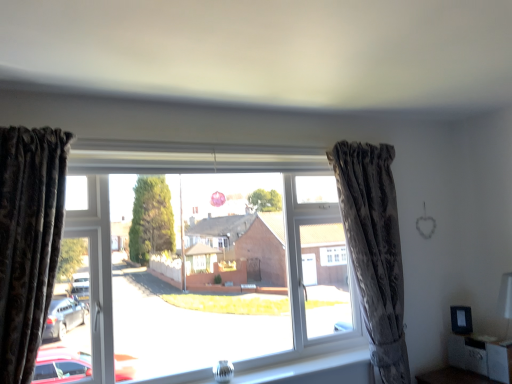
Question: From the image's perspective, is matte black cabinet at lower right located above or below camouflage fabric curtain at right, which is the first curtain in back-to-front order?

Choices:
 (A) below
 (B) above

Answer: (A)

Question: Based on their sizes in the image, would you say matte black cabinet at lower right is bigger or smaller than camouflage fabric curtain at right, which is the first curtain in back-to-front order?

Choices:
 (A) big
 (B) small

Answer: (B)

Question: Estimate the real-world distances between objects in this image. Which object is closer to the transparent glass window at center?

Choices:
 (A) velvet dark brown curtain at left, the first curtain when ordered from front to back
 (B) camouflage fabric curtain at right, marked as the second curtain in a left-to-right arrangement
 (C) matte black cabinet at lower right
 (D) clear glass vase at lower center

Answer: (D)

Question: Which object is the farthest from the clear glass vase at lower center?

Choices:
 (A) matte black cabinet at lower right
 (B) camouflage fabric curtain at right, the first curtain viewed from the right
 (C) velvet dark brown curtain at left, acting as the 2th curtain starting from the right
 (D) transparent glass window at center

Answer: (C)